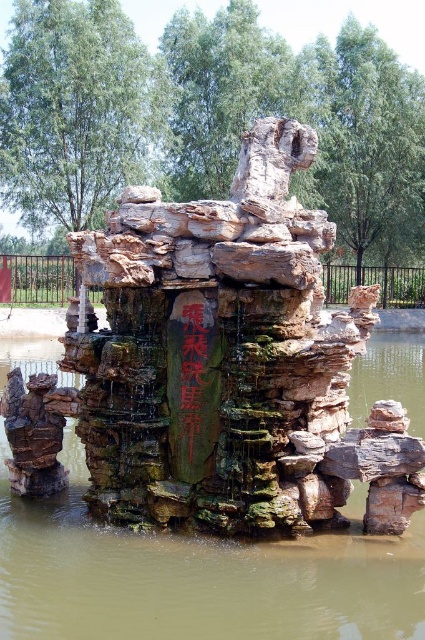
You are a gardener who wants to place a small potted plant between the green mossy rock at center and the black stone writing at center. Based on their positions, where should you place the plant so it is between them?

The green mossy rock at center is positioned under the black stone writing at center, so placing the plant between them would require positioning it below the black stone writing at center and above the green mossy rock at center.

You are standing at the edge of the water in the image. There is a point marked at coordinates point (198,576). Which object is located at that point?

The point (198,576) marks the green mossy rock at center.